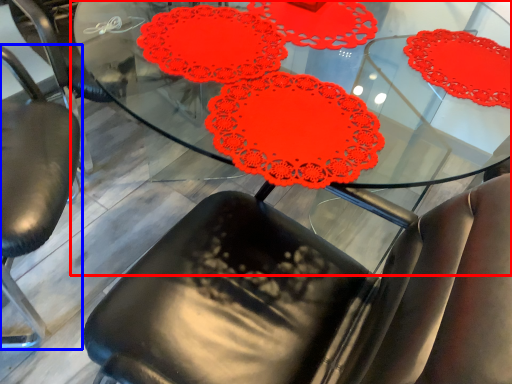
Question: Among these objects, which one is farthest to the camera, table (highlighted by a red box) or chair (highlighted by a blue box)?

Choices:
 (A) table
 (B) chair

Answer: (B)